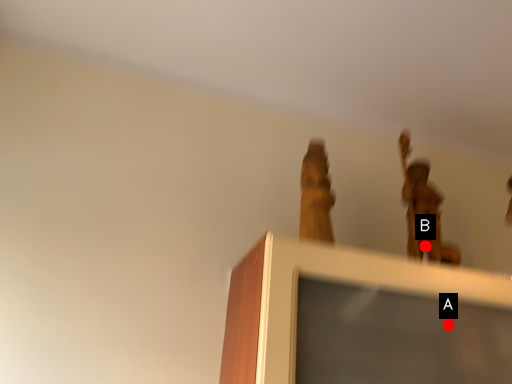
Question: Two points are circled on the image, labeled by A and B beside each circle. Among these points, which one is nearest to the camera?

Choices:
 (A) A is closer
 (B) B is closer

Answer: (A)